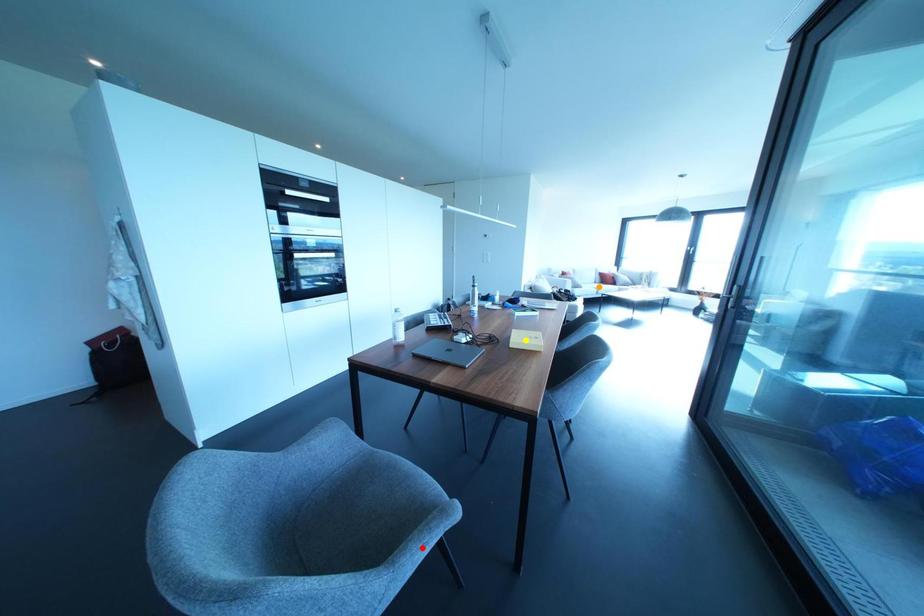
Order these from nearest to farthest:
orange point
red point
yellow point

orange point
yellow point
red point